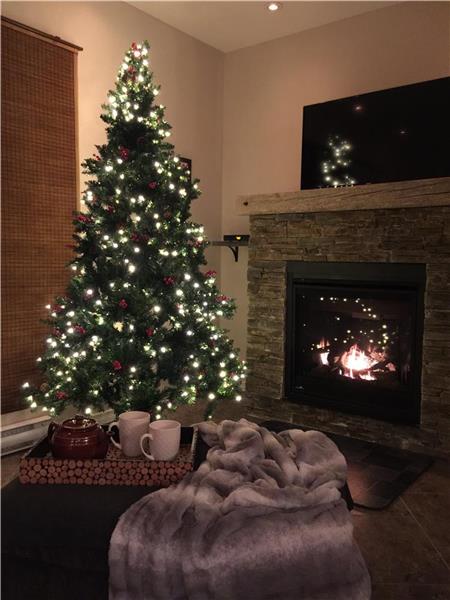
I want to click on wall, so click(272, 145).